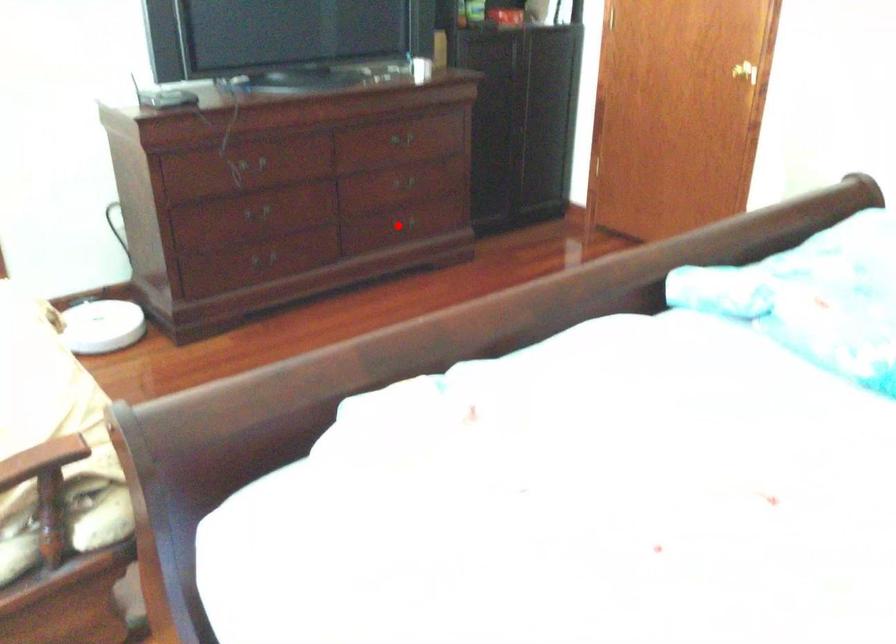
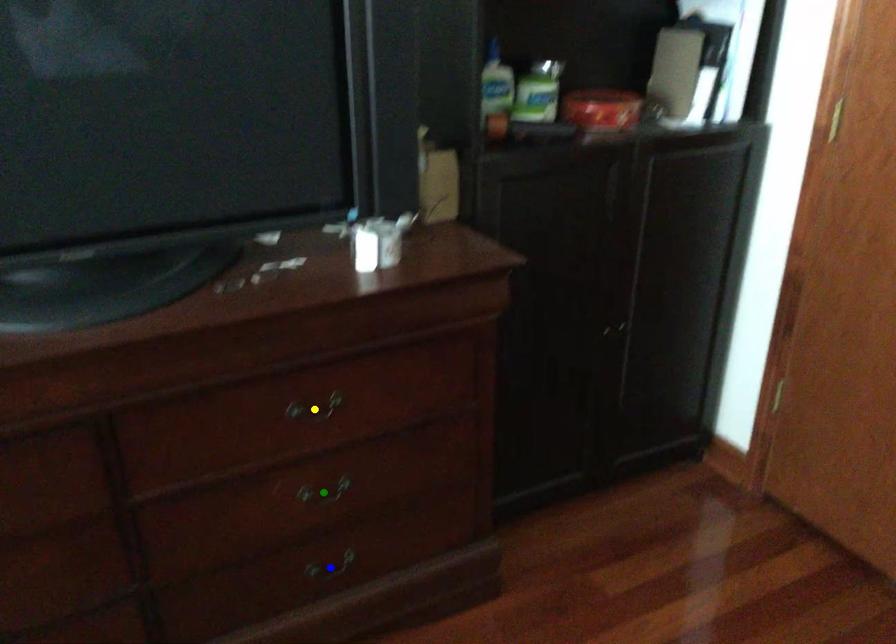
Question: I am providing you with two images of the same scene from different viewpoints. A red point is marked on the first image. You are given multiple points on the second image. Which spot in image 2 lines up with the point in image 1?

Choices:
 (A) green point
 (B) yellow point
 (C) blue point

Answer: (C)